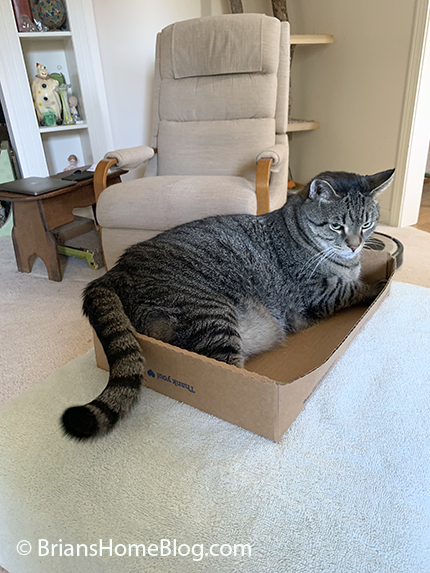
The width and height of the screenshot is (430, 573). I want to click on wall, so click(354, 123).